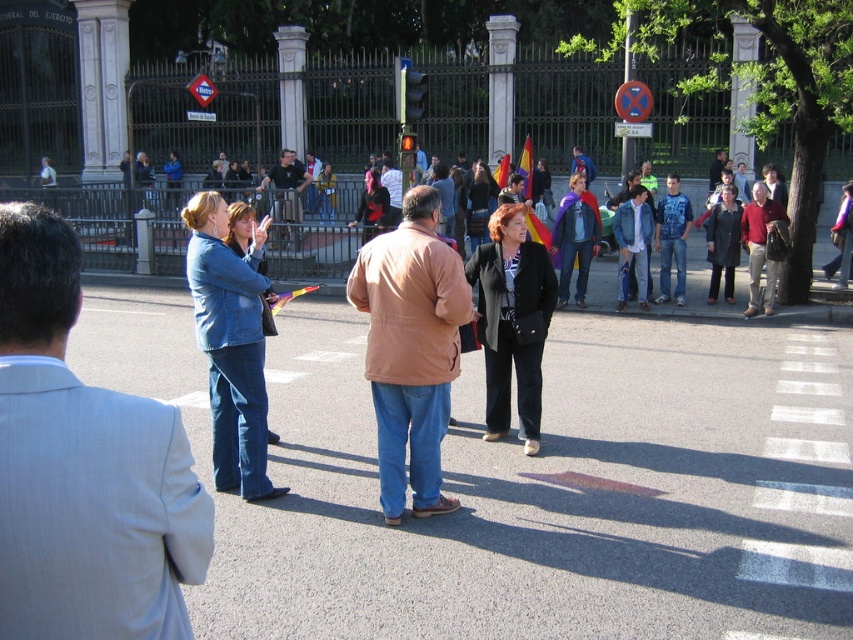
Question: Is light blue denim jeans at center positioned before dark blue jeans at center?

Choices:
 (A) yes
 (B) no

Answer: (A)

Question: Which of these objects is positioned closest to the dark blue jeans at center?

Choices:
 (A) light blue denim jeans at center
 (B) brown leather jacket at center

Answer: (B)

Question: Is the position of light blue denim jeans at center more distant than that of dark blue jeans at center?

Choices:
 (A) yes
 (B) no

Answer: (B)

Question: Which of the following is the farthest from the observer?

Choices:
 (A) light blue denim jeans at center
 (B) brown leather jacket at center

Answer: (B)

Question: Can you confirm if brown leather jacket at center is smaller than dark blue jeans at center?

Choices:
 (A) no
 (B) yes

Answer: (A)

Question: Which point is farther to the camera?

Choices:
 (A) (408, 420)
 (B) (149, 541)

Answer: (A)